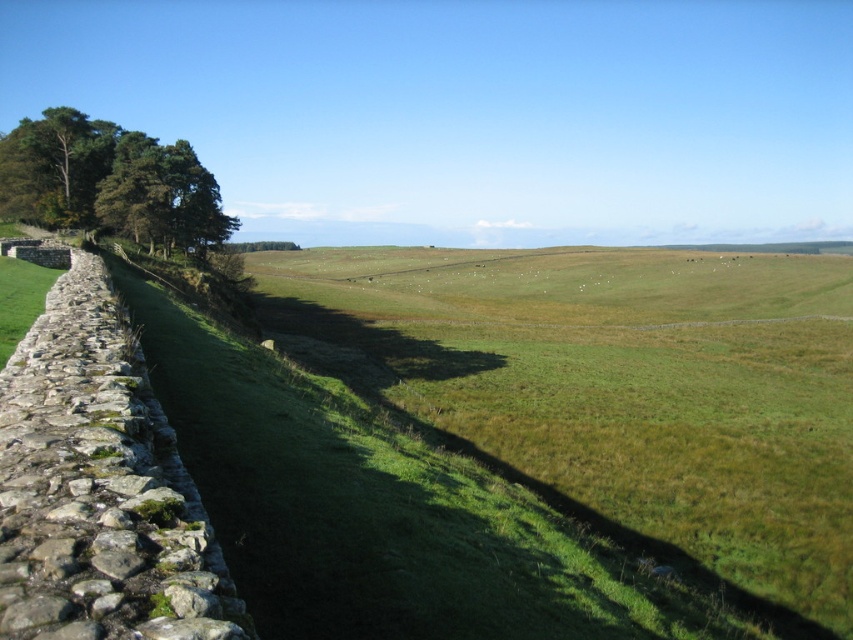
You are standing in the middle of the field in the image and see two points marked on the ground. One is labeled as point (550, 611) and the other as point (192, 154). Which point is closer to you?

Point (192, 154) is closer to you because it is behind point (550, 611), which is in front of it.

You are a landscape photographer planning to capture the entire green grassy field at center and the green leafy tree at upper left in a single shot. Given that your camera has a fixed focal length, which object should you focus on to ensure both are in sharp focus?

The green grassy field at center has a larger size compared to the green leafy tree at upper left, so focusing on the green grassy field at center will ensure both are in sharp focus because it is closer to the camera.

You are standing in the middle of the green grassy field at center and want to walk towards the green leafy tree at upper left. Which direction should you head?

You should head to the left because the green grassy field at center is to the right of the green leafy tree at upper left, so moving left will take you towards the tree.